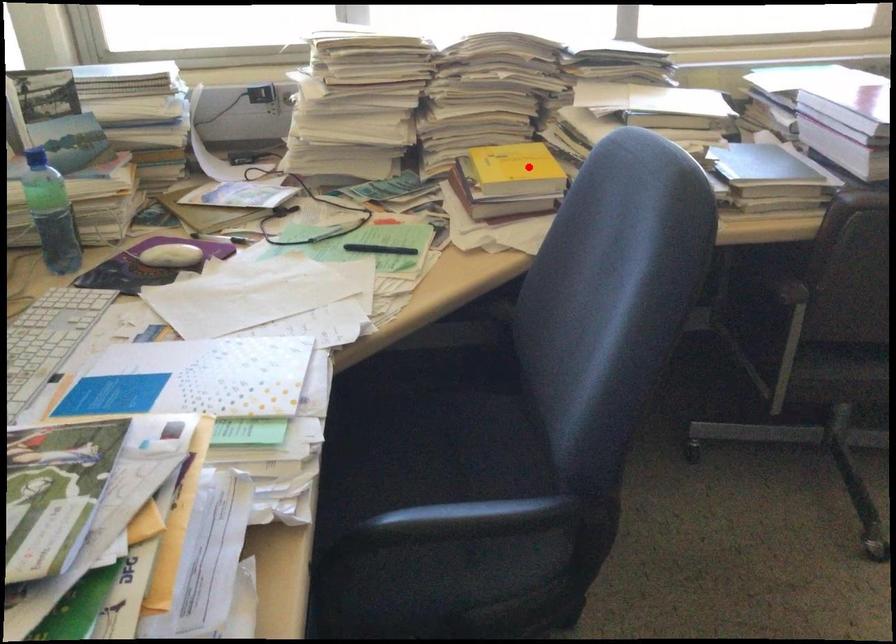
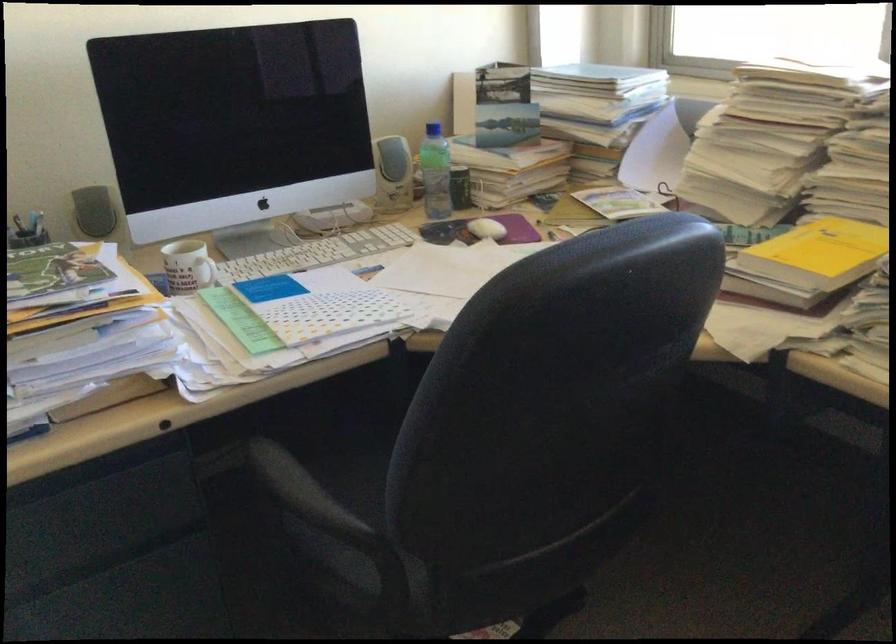
Question: I am providing you with two images of the same scene from different viewpoints. Image1 has a red point marked. In image2, the corresponding 3D location appears at what relative position? Reply with the corresponding letter.

Choices:
 (A) Closer
 (B) Farther

Answer: (A)